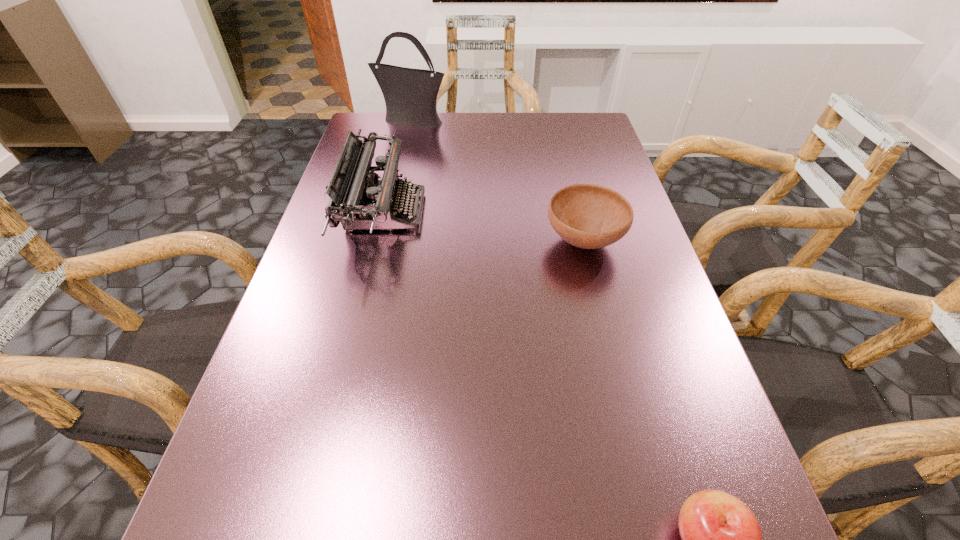
Where is `shoulder bag`? The height and width of the screenshot is (540, 960). shoulder bag is located at coordinates (410, 95).

Locate an element on the screen. This screenshot has height=540, width=960. the farthest object is located at coordinates (410, 95).

You are a GUI agent. You are given a task and a screenshot of the screen. Output one action in this format:
    pyautogui.click(x=<x>, y=<y>)
    Task: Click on the typewriter
    This screenshot has height=540, width=960.
    Given the screenshot: What is the action you would take?
    pyautogui.click(x=358, y=200)

Where is `bowl`? This screenshot has height=540, width=960. bowl is located at coordinates (588, 216).

The height and width of the screenshot is (540, 960). I want to click on free space located 0.190m on the right of the shoulder bag, so click(x=510, y=120).

Locate an element on the screen. The height and width of the screenshot is (540, 960). free space located 0.060m on the typing side of the typewriter is located at coordinates (448, 212).

Locate an element on the screen. vacant region located on the front of the bowl is located at coordinates (635, 446).

Locate an element on the screen. This screenshot has width=960, height=540. object that is positioned at the far edge is located at coordinates point(410,95).

Locate an element on the screen. shoulder bag situated at the left edge is located at coordinates (410, 95).

Where is `typewriter present at the left edge`? The height and width of the screenshot is (540, 960). typewriter present at the left edge is located at coordinates (358, 200).